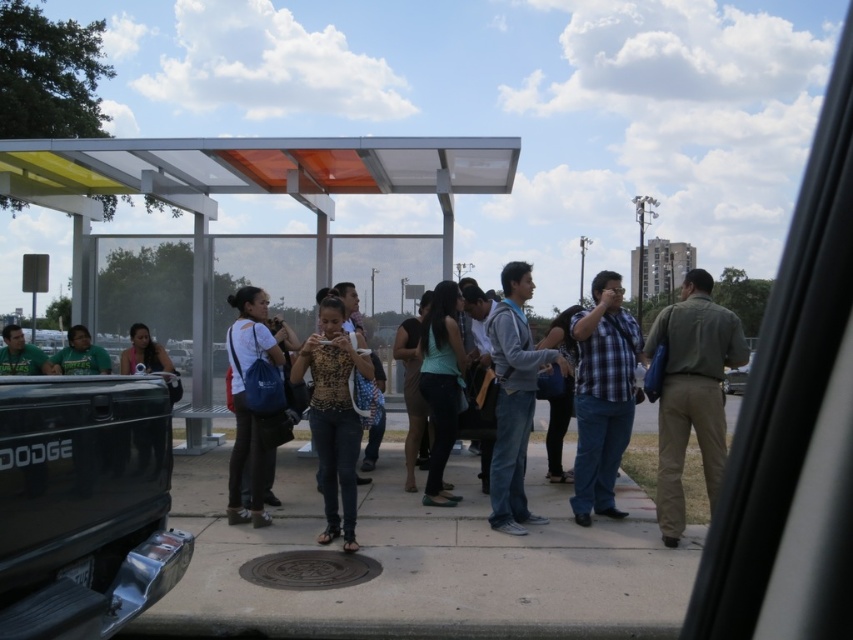
Is translucent plastic bus stop at center to the left of teal fabric shirt at center from the viewer's perspective?

Yes, translucent plastic bus stop at center is to the left of teal fabric shirt at center.

Does translucent plastic bus stop at center appear on the right side of teal fabric shirt at center?

Incorrect, translucent plastic bus stop at center is not on the right side of teal fabric shirt at center.

Describe the element at coordinates (247, 188) in the screenshot. I see `translucent plastic bus stop at center` at that location.

You are a GUI agent. You are given a task and a screenshot of the screen. Output one action in this format:
    pyautogui.click(x=<x>, y=<y>)
    Task: Click on the translucent plastic bus stop at center
    
    Given the screenshot: What is the action you would take?
    pyautogui.click(x=247, y=188)

Between point (622, 442) and point (165, 356), which one is positioned behind?

The point (165, 356) is behind.

Does point (608, 337) lie behind point (140, 339)?

No.

This screenshot has height=640, width=853. I want to click on plaid shirt at center, so coord(602,396).

Identify the location of plaid shirt at center. Image resolution: width=853 pixels, height=640 pixels. (602, 396).

How much distance is there between gray fleece jacket at center and matte green shirt at lower left?

gray fleece jacket at center is 5.34 meters from matte green shirt at lower left.

Who is taller, gray fleece jacket at center or matte green shirt at lower left?

gray fleece jacket at center is taller.

What do you see at coordinates (514, 397) in the screenshot? The height and width of the screenshot is (640, 853). I see `gray fleece jacket at center` at bounding box center [514, 397].

I want to click on gray fleece jacket at center, so click(514, 397).